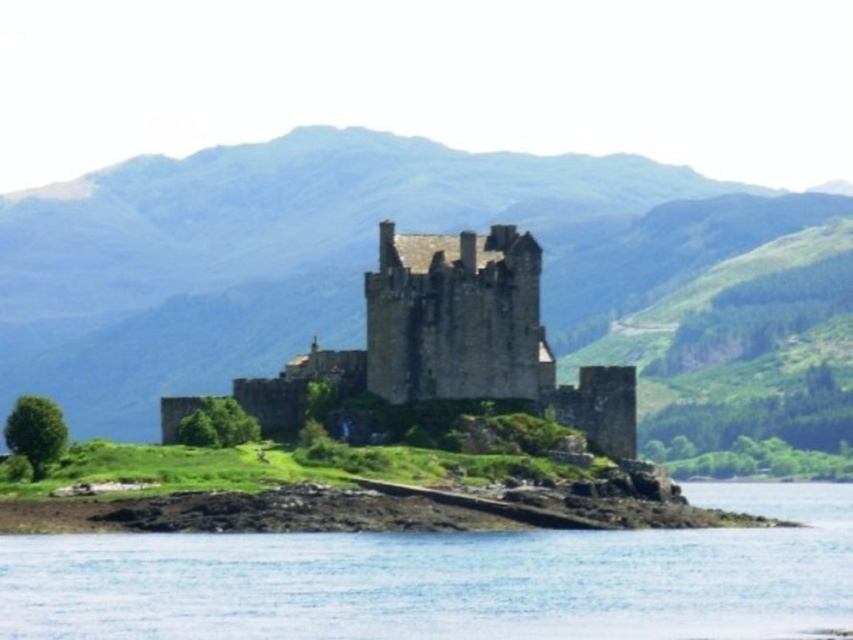
Is brown stone castle at center thinner than rocks at lower left?

Yes.

Find the location of `brown stone castle at center`. brown stone castle at center is located at coordinates (454, 340).

Can you confirm if clear blue water at lower center is taller than rocks at lower left?

Indeed, clear blue water at lower center has a greater height compared to rocks at lower left.

Describe the element at coordinates (448, 579) in the screenshot. The height and width of the screenshot is (640, 853). I see `clear blue water at lower center` at that location.

You are a GUI agent. You are given a task and a screenshot of the screen. Output one action in this format:
    pyautogui.click(x=<x>, y=<y>)
    Task: Click on the clear blue water at lower center
    
    Given the screenshot: What is the action you would take?
    pyautogui.click(x=448, y=579)

Who is higher up, clear blue water at lower center or brown stone castle at center?

Positioned higher is brown stone castle at center.

Is clear blue water at lower center to the left of brown stone castle at center from the viewer's perspective?

In fact, clear blue water at lower center is to the right of brown stone castle at center.

Does point (27, 563) come in front of point (616, 368)?

Yes.

The width and height of the screenshot is (853, 640). In order to click on clear blue water at lower center in this screenshot , I will do `click(448, 579)`.